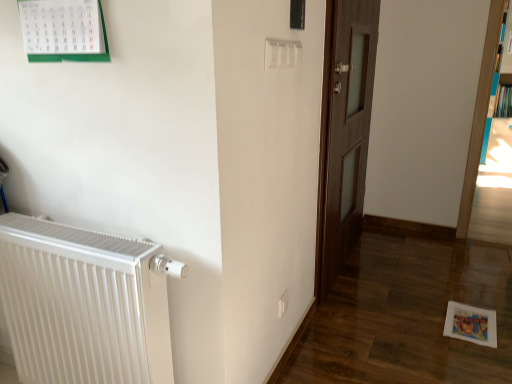
Find the location of a particular element. The image size is (512, 384). vacant space underneath dark wood door at center (from a real-world perspective) is located at coordinates (346, 265).